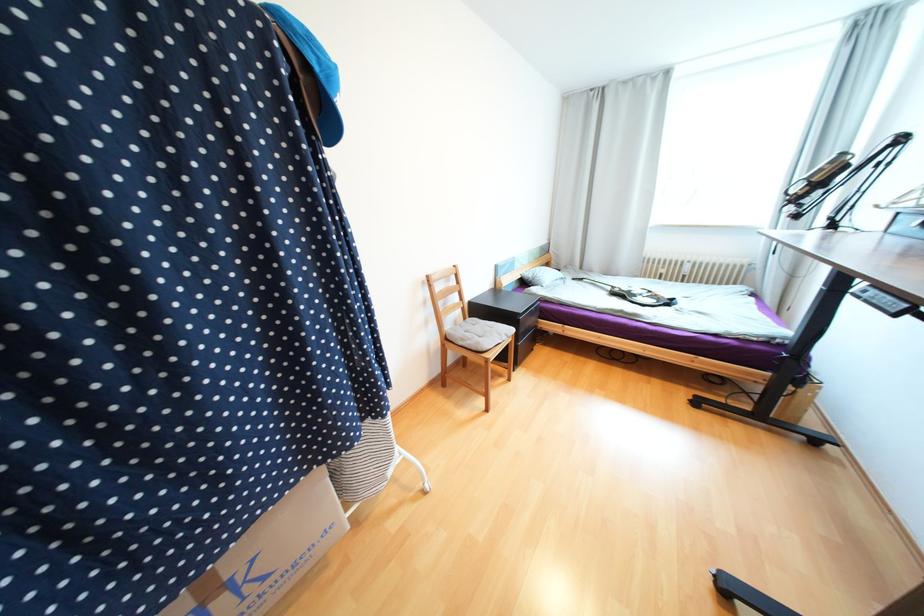
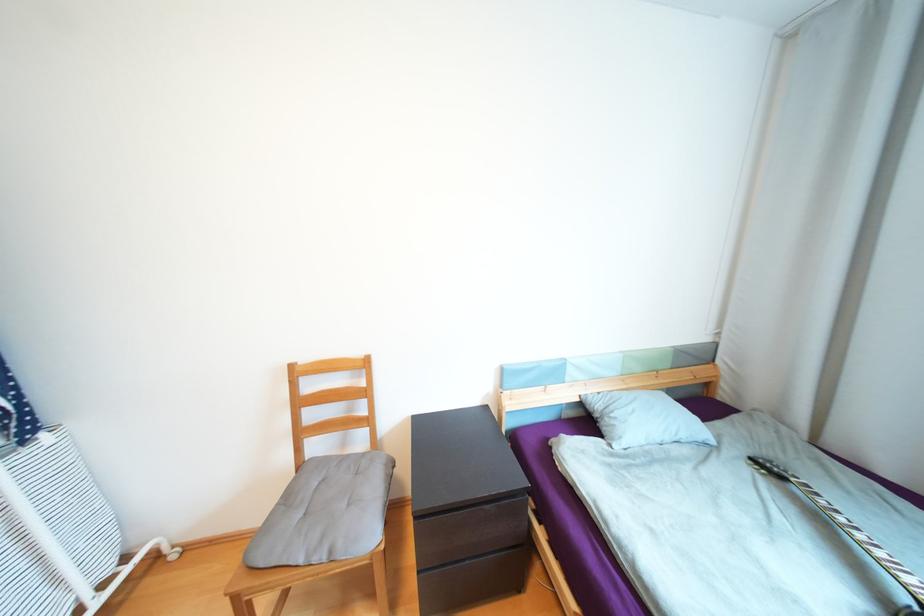
Where in the second image is the point corresponding to point (588, 280) from the first image?

(787, 477)